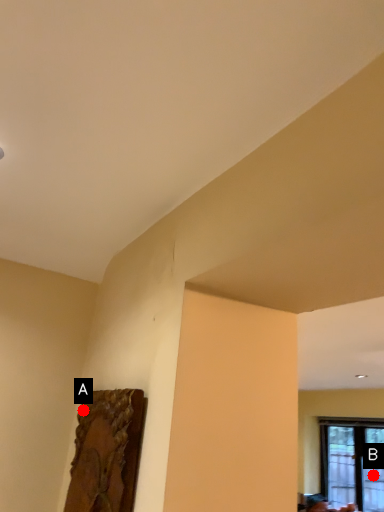
Question: Two points are circled on the image, labeled by A and B beside each circle. Which point is closer to the camera taking this photo?

Choices:
 (A) A is closer
 (B) B is closer

Answer: (A)